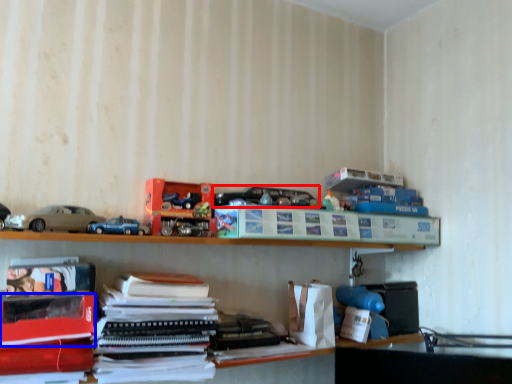
Question: Which object is further to the camera taking this photo, toy (highlighted by a red box) or paperback book (highlighted by a blue box)?

Choices:
 (A) toy
 (B) paperback book

Answer: (A)